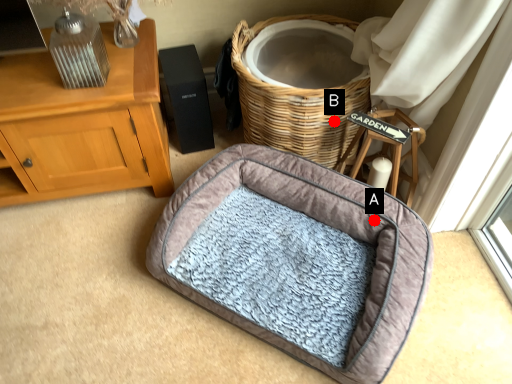
Question: Two points are circled on the image, labeled by A and B beside each circle. Among these points, which one is farthest from the camera?

Choices:
 (A) A is further
 (B) B is further

Answer: (B)